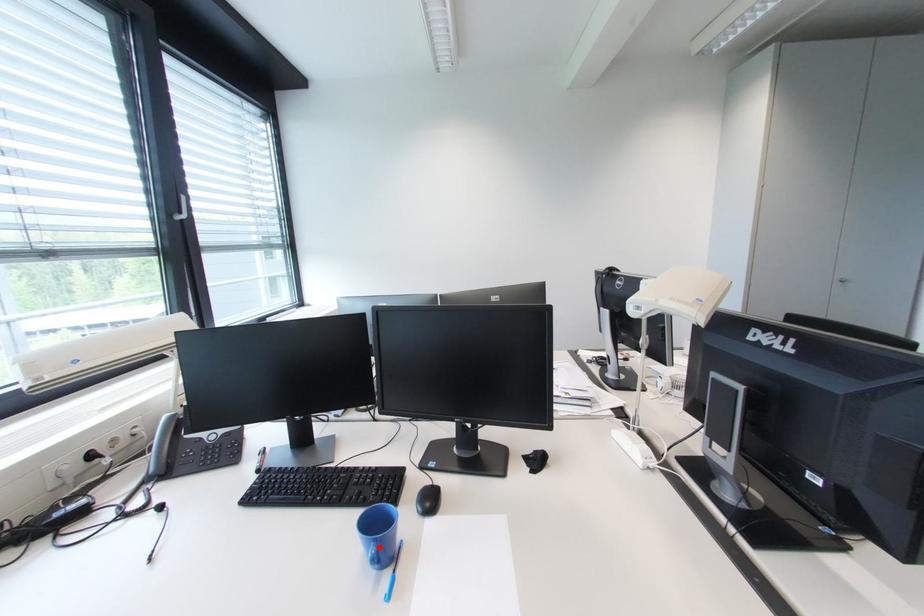
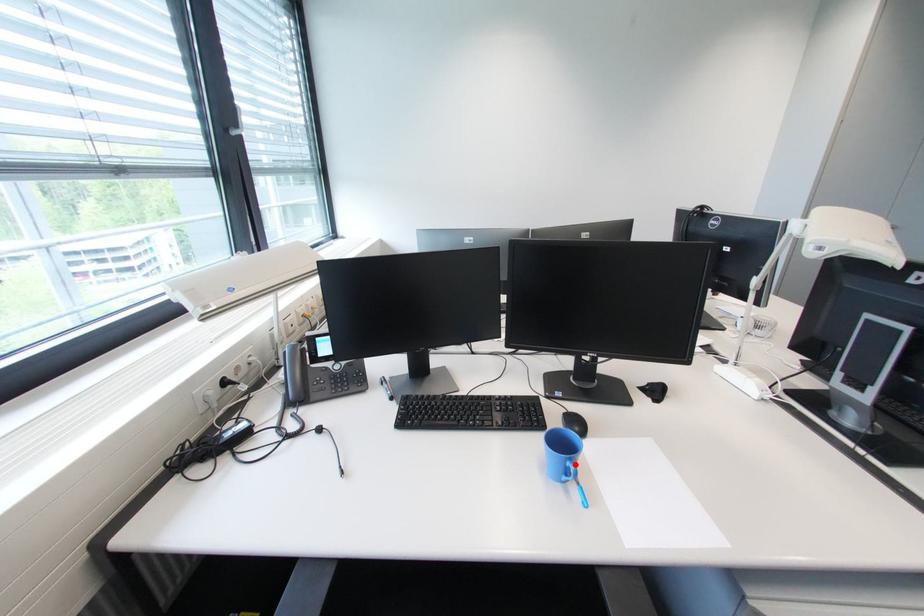
I am providing you with two images of the same scene from different viewpoints. A red point is marked on the first image and another point is marked on the second image. Is the marked point in image1 the same physical position as the marked point in image2?

Yes